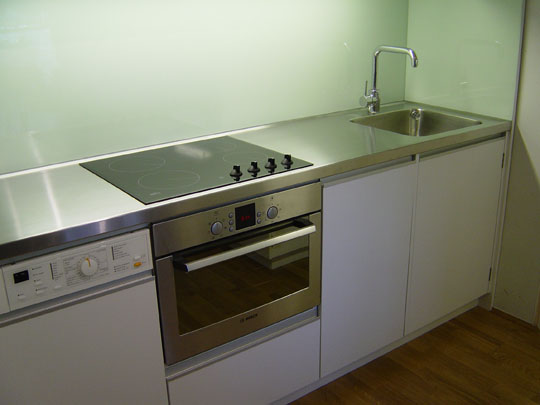
The height and width of the screenshot is (405, 540). Find the location of `burner plates`. burner plates is located at coordinates (220, 145), (244, 157), (168, 183), (134, 165).